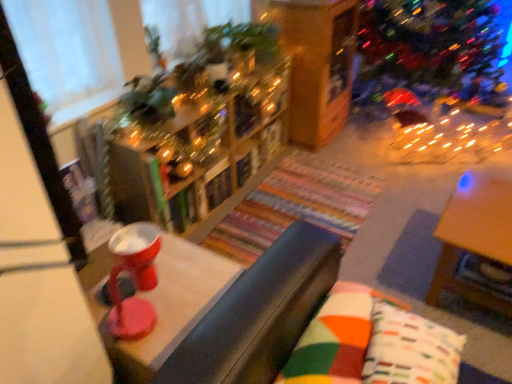
Question: From a real-world perspective, is shiny plastic bowl at center, the 2th table in the right-to-left sequence, on wooden table at right, acting as the 2th table starting from the left?

Choices:
 (A) yes
 (B) no

Answer: (A)

Question: From the image's perspective, does shiny plastic bowl at center, the 1th table when ordered from left to right, appear lower than wooden table at right, the 1th table when ordered from right to left?

Choices:
 (A) yes
 (B) no

Answer: (A)

Question: From the image's perspective, is shiny plastic bowl at center, the 2th table in the right-to-left sequence, located above wooden table at right, the 1th table when ordered from right to left?

Choices:
 (A) yes
 (B) no

Answer: (B)

Question: Is shiny plastic bowl at center, the 1th table when ordered from left to right, bigger than wooden table at right, the 1th table when ordered from right to left?

Choices:
 (A) no
 (B) yes

Answer: (A)

Question: In terms of size, does wooden bookshelf at center appear bigger or smaller than shiny plastic bowl at center, the 1th table when ordered from left to right?

Choices:
 (A) small
 (B) big

Answer: (A)

Question: Is wooden bookshelf at center to the left or to the right of shiny plastic bowl at center, the 2th table in the right-to-left sequence, in the image?

Choices:
 (A) left
 (B) right

Answer: (B)

Question: Is point (256, 107) positioned closer to the camera than point (99, 223)?

Choices:
 (A) closer
 (B) farther

Answer: (B)

Question: From a real-world perspective, relative to shiny plastic bowl at center, the 1th table when ordered from left to right, is wooden bookshelf at center vertically above or below?

Choices:
 (A) below
 (B) above

Answer: (B)

Question: Considering the positions of wooden bookshelf at center and multicolored fabric pillow at center, the 1th pillow positioned from the left, in the image, is wooden bookshelf at center bigger or smaller than multicolored fabric pillow at center, the 1th pillow positioned from the left,?

Choices:
 (A) small
 (B) big

Answer: (B)

Question: Visually, is wooden bookshelf at center positioned to the left or to the right of multicolored fabric pillow at center, which is the second pillow in right-to-left order?

Choices:
 (A) right
 (B) left

Answer: (B)

Question: Considering their positions, is wooden bookshelf at center located in front of or behind multicolored fabric pillow at center, the 1th pillow positioned from the left?

Choices:
 (A) front
 (B) behind

Answer: (B)

Question: Which is correct: wooden bookshelf at center is inside multicolored fabric pillow at center, the 1th pillow positioned from the left, or outside of it?

Choices:
 (A) inside
 (B) outside

Answer: (B)

Question: Is wooden table at right, acting as the 2th table starting from the left, wider or thinner than wooden bookshelf at center?

Choices:
 (A) thin
 (B) wide

Answer: (B)

Question: Is point (501, 244) positioned closer to the camera than point (131, 170)?

Choices:
 (A) farther
 (B) closer

Answer: (B)